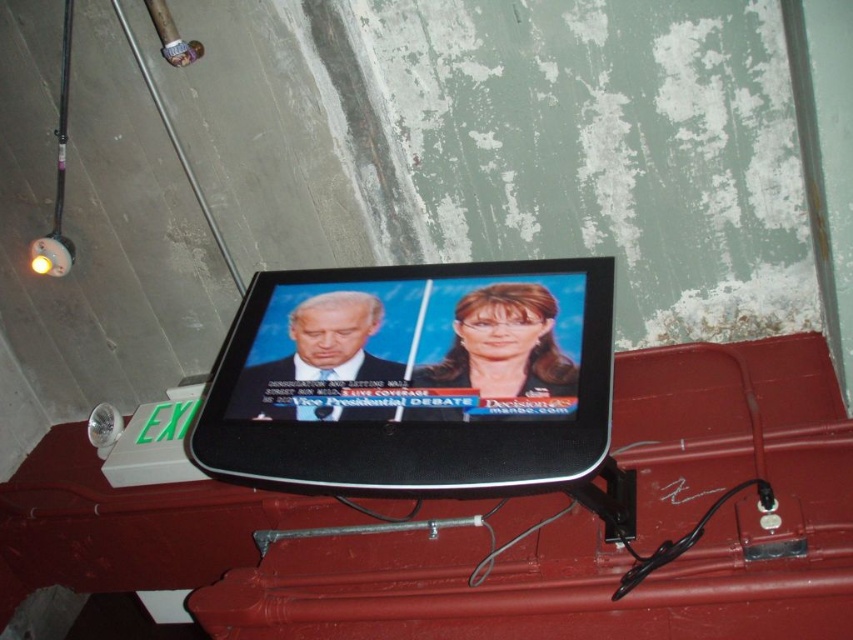
You are standing in a room with a black glossy screen at center and a matte black lamp at upper left. You want to hang a new picture frame between them. Is there enough vertical space between the two objects to fit a frame that is 15 cm tall?

The black glossy screen at center is located below the matte black lamp at upper left. Since the vertical distance between them isn

You are a interior designer assessing the placement of the black glossy screen at center and the matte black lamp at upper left. Which object is shorter in height?

The black glossy screen at center has a lesser height compared to the matte black lamp at upper left, so the black glossy screen at center is shorter in height.

You are standing in a room with a small black flat screen TV mounted on a red wall. You need to locate the black glossy screen at center. Where exactly is it positioned in the room?

The black glossy screen at center is located at point 0.591 on the x axis and 0.487 on the y axis.